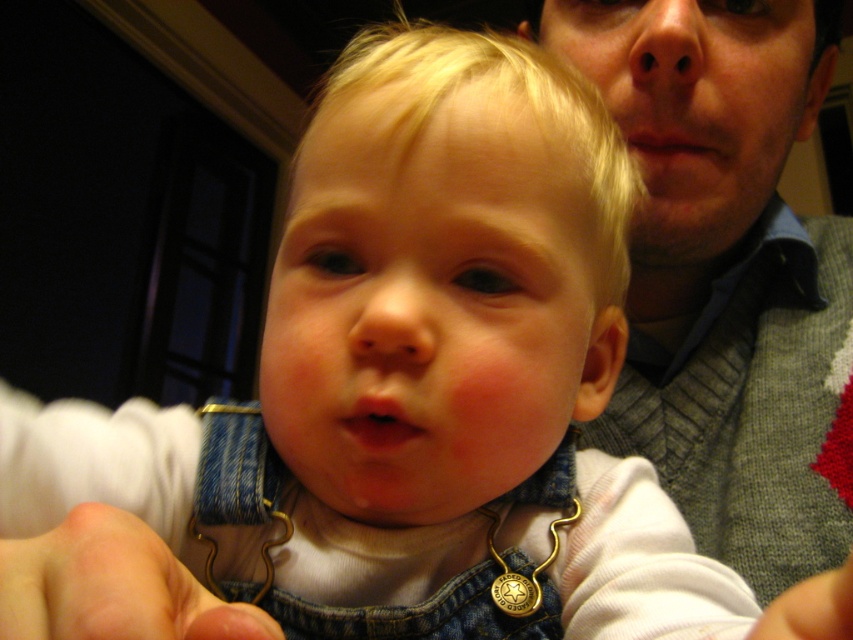
Question: Can you confirm if gray knitted sweater at upper right is positioned to the left of fuzzy white hand at lower left?

Choices:
 (A) no
 (B) yes

Answer: (A)

Question: Which object is farther from the camera taking this photo?

Choices:
 (A) fuzzy white hand at lower left
 (B) gray knitted sweater at upper right
 (C) denim at center

Answer: (B)

Question: Can you confirm if gray knitted sweater at upper right is positioned to the left of fuzzy white hand at lower left?

Choices:
 (A) no
 (B) yes

Answer: (A)

Question: Does denim at center come in front of fuzzy white hand at lower left?

Choices:
 (A) yes
 (B) no

Answer: (B)

Question: Which object appears closest to the camera in this image?

Choices:
 (A) denim at center
 (B) fuzzy white hand at lower left

Answer: (B)

Question: Estimate the real-world distances between objects in this image. Which object is farther from the denim at center?

Choices:
 (A) gray knitted sweater at upper right
 (B) fuzzy white hand at lower left

Answer: (A)